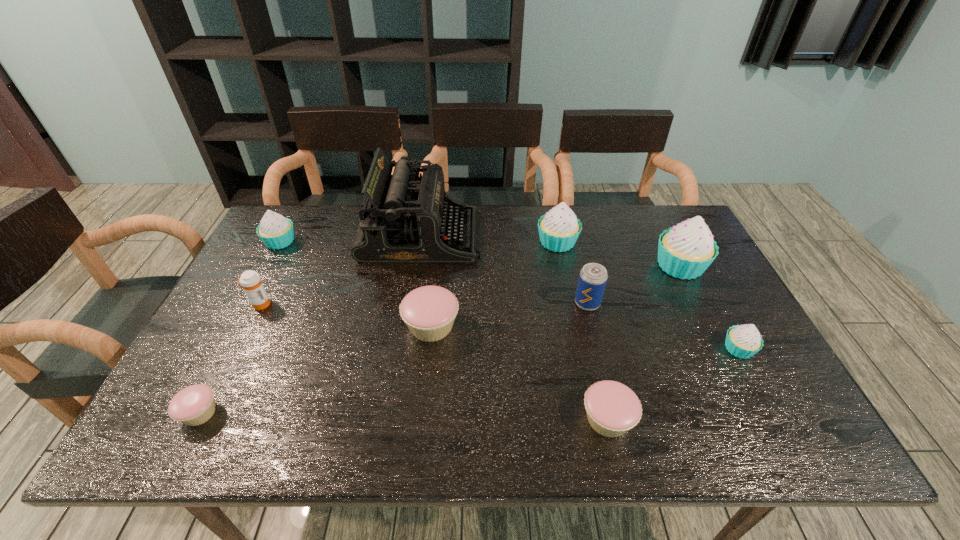
What are the coordinates of `pink cupcake object that ranks as the third closest to the third tallest object` in the screenshot? It's located at [x=194, y=405].

At what (x,y) coordinates should I click in order to perform the action: click on free region that satisfies the following two spatial constraints: 1. on the keyboard of the typewriter; 2. on the back side of the eighth shortest object. Please return your answer as a coordinate pair (x, y). Looking at the image, I should click on (x=420, y=242).

In order to click on vacant area that satisfies the following two spatial constraints: 1. on the front side of the smallest white cupcake; 2. on the right side of the medicine in this screenshot , I will do `click(238, 349)`.

Where is `vacant area that satisfies the following two spatial constraints: 1. on the back side of the biggest pink cupcake; 2. on the right side of the shortest object`? vacant area that satisfies the following two spatial constraints: 1. on the back side of the biggest pink cupcake; 2. on the right side of the shortest object is located at coordinates (244, 326).